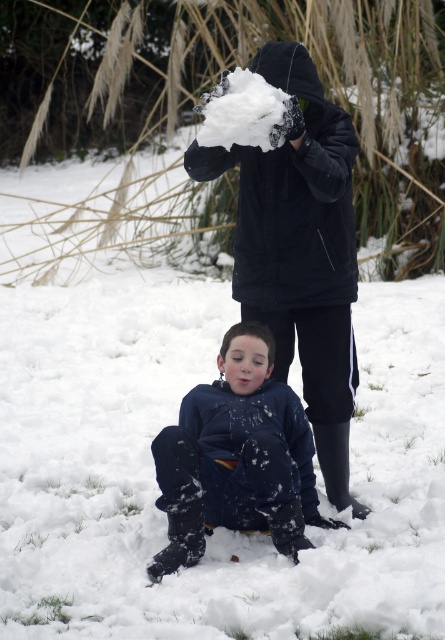
Is matte black jacket at upper center taller than dark blue fleece at lower center?

Yes.

You are a GUI agent. You are given a task and a screenshot of the screen. Output one action in this format:
    pyautogui.click(x=<x>, y=<y>)
    Task: Click on the matte black jacket at upper center
    
    Given the screenshot: What is the action you would take?
    pyautogui.click(x=300, y=252)